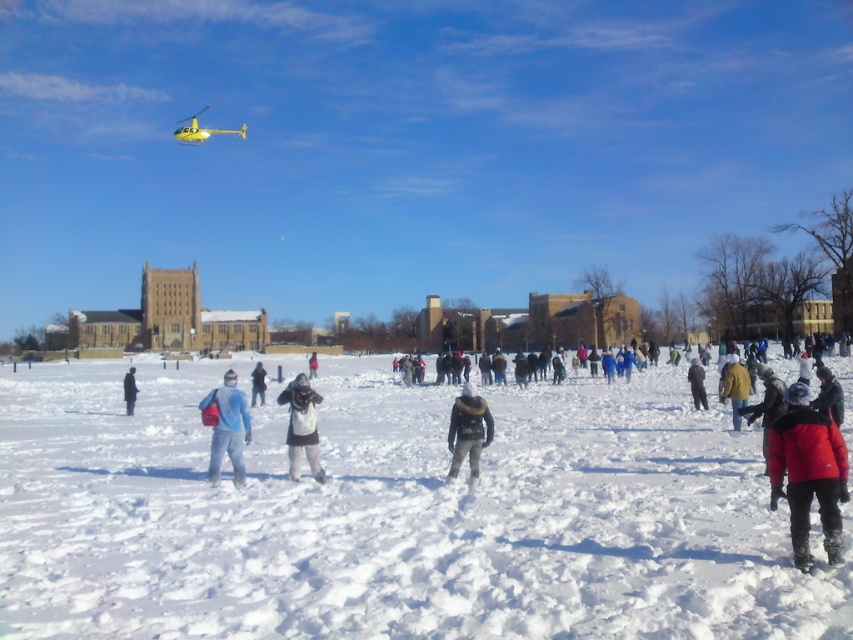
Question: Is red wool coat at lower right smaller than dark gray wool coat at lower left?

Choices:
 (A) no
 (B) yes

Answer: (A)

Question: Is yellow matte helicopter at upper left thinner than dark gray wool coat at lower left?

Choices:
 (A) no
 (B) yes

Answer: (A)

Question: Which point is farther to the camera?

Choices:
 (A) (314, 369)
 (B) (780, 442)

Answer: (A)

Question: Does red fleece jacket at lower right have a smaller size compared to red wool coat at lower right?

Choices:
 (A) yes
 (B) no

Answer: (A)

Question: Which object is positioned closest to the red wool coat at lower right?

Choices:
 (A) yellow matte helicopter at upper left
 (B) white fleece jacket at center
 (C) matte blue jacket at center
 (D) red fleece jacket at lower right

Answer: (D)

Question: Which of the following is the closest to the observer?

Choices:
 (A) white fleece jacket at center
 (B) yellow woolen jacket at center

Answer: (A)